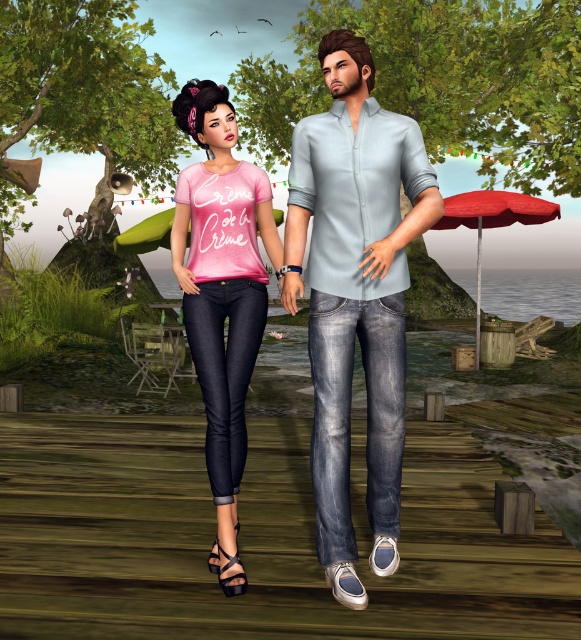
You are a photographer setting up a shot of the two characters on the boardwalk. You notice two points marked in the scene at coordinates point [493,189] and point [272,211]. Which point is closer to your camera position?

Point [272,211] is closer to the camera because point [493,189] is further away from the camera than point [272,211].